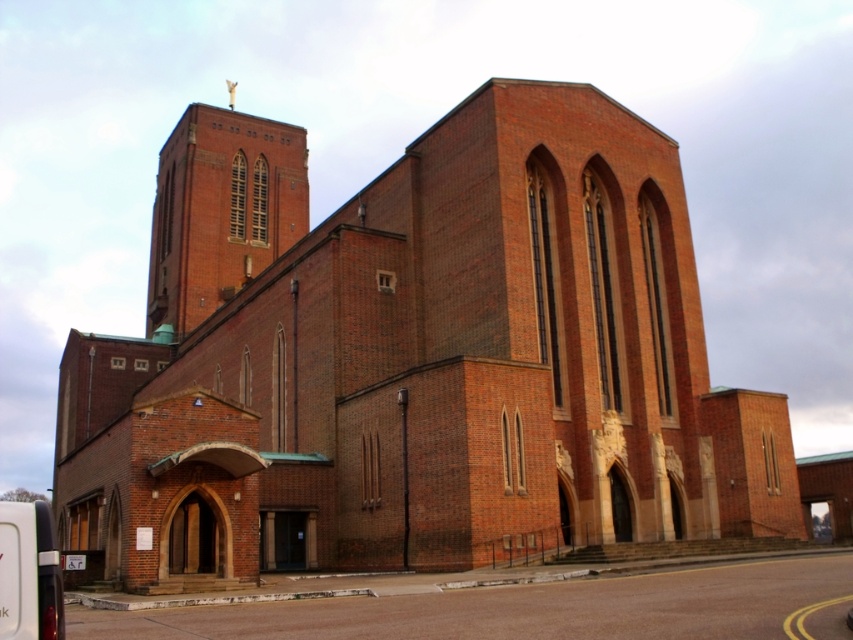
Question: Which point is closer to the camera taking this photo?

Choices:
 (A) (154, 252)
 (B) (448, 524)

Answer: (B)

Question: Does red brick church at center appear over brick tower at upper center?

Choices:
 (A) yes
 (B) no

Answer: (B)

Question: Does red brick church at center appear on the right side of brick tower at upper center?

Choices:
 (A) yes
 (B) no

Answer: (A)

Question: Which of the following is the farthest from the observer?

Choices:
 (A) red brick church at center
 (B) brick tower at upper center

Answer: (B)

Question: Does red brick church at center appear under brick tower at upper center?

Choices:
 (A) no
 (B) yes

Answer: (B)

Question: Which object is closer to the camera taking this photo?

Choices:
 (A) brick tower at upper center
 (B) red brick church at center

Answer: (B)